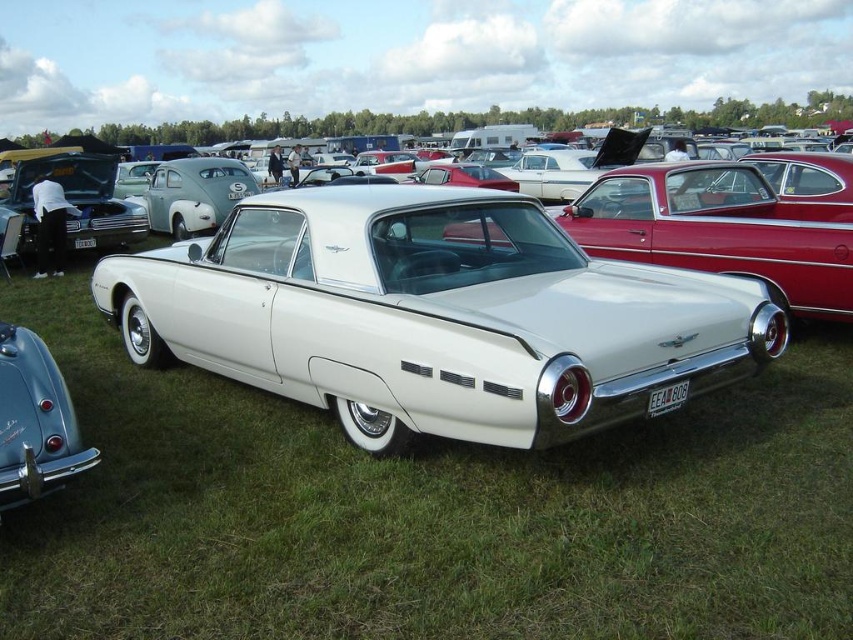
Does white glossy car at center have a greater height compared to shiny chrome bumper at lower left?

Correct, white glossy car at center is much taller as shiny chrome bumper at lower left.

Who is lower down, white glossy car at center or shiny chrome bumper at lower left?

shiny chrome bumper at lower left is lower down.

Who is more forward, (x=689, y=298) or (x=3, y=352)?

Point (x=3, y=352) is more forward.

Find the location of a particular element. white glossy car at center is located at coordinates (434, 316).